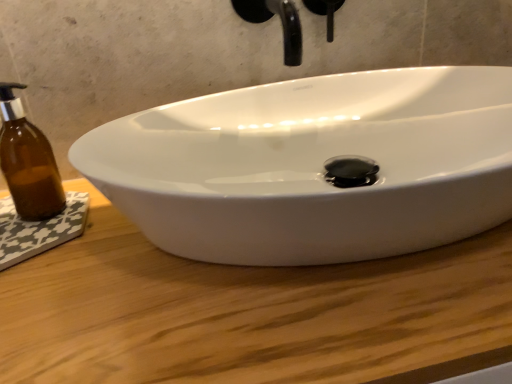
Question: Is wooden at center facing away from black matte faucet at upper center?

Choices:
 (A) no
 (B) yes

Answer: (A)

Question: Does wooden at center turn towards black matte faucet at upper center?

Choices:
 (A) no
 (B) yes

Answer: (A)

Question: Can you confirm if wooden at center is wider than black matte faucet at upper center?

Choices:
 (A) no
 (B) yes

Answer: (B)

Question: Is wooden at center outside black matte faucet at upper center?

Choices:
 (A) yes
 (B) no

Answer: (A)

Question: Can you confirm if wooden at center is taller than black matte faucet at upper center?

Choices:
 (A) yes
 (B) no

Answer: (A)

Question: Does wooden at center have a smaller size compared to black matte faucet at upper center?

Choices:
 (A) no
 (B) yes

Answer: (A)

Question: Would you say brown glass bottle at left is part of black matte faucet at upper center's contents?

Choices:
 (A) no
 (B) yes

Answer: (A)

Question: Is there a large distance between black matte faucet at upper center and brown glass bottle at left?

Choices:
 (A) yes
 (B) no

Answer: (B)

Question: From a real-world perspective, is black matte faucet at upper center beneath brown glass bottle at left?

Choices:
 (A) yes
 (B) no

Answer: (B)

Question: Is black matte faucet at upper center positioned with its back to brown glass bottle at left?

Choices:
 (A) no
 (B) yes

Answer: (A)

Question: Does black matte faucet at upper center have a lesser height compared to brown glass bottle at left?

Choices:
 (A) no
 (B) yes

Answer: (B)

Question: Is black matte faucet at upper center positioned before brown glass bottle at left?

Choices:
 (A) no
 (B) yes

Answer: (B)

Question: From the image's perspective, does brown glass bottle at left appear lower than wooden at center?

Choices:
 (A) yes
 (B) no

Answer: (B)